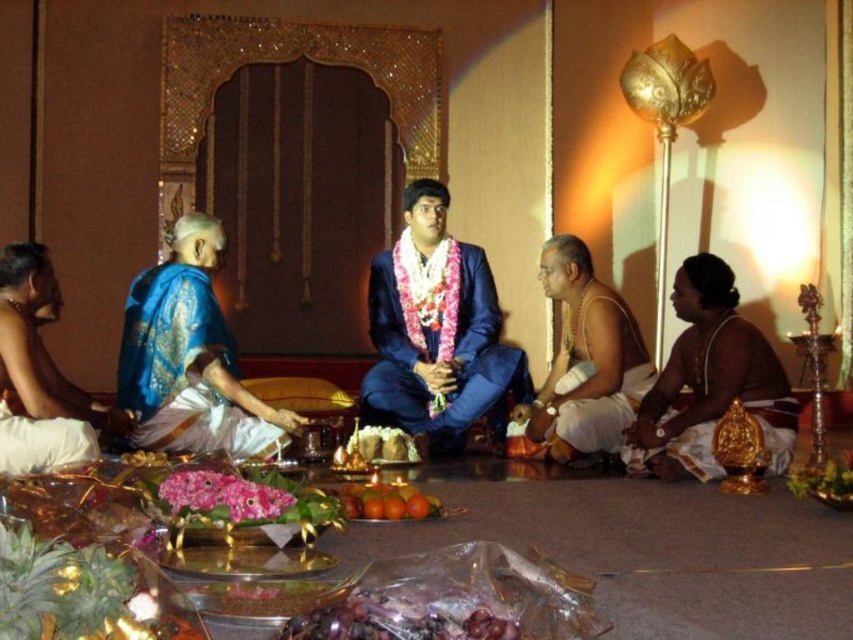
You are attending an Indian ceremony and notice two traditional garments in the scene. The blue silk saree at left and the brown silk dhoti at right. Which one is positioned to the left of the other?

The blue silk saree at left is positioned to the left of the brown silk dhoti at right.

You are a photographer at the ceremony and want to capture both the white silk dhoti at center and the shiny plastic grapes at center in a single photo. Which object should you focus on first to ensure both are in frame?

The white silk dhoti at center is larger in size than the shiny plastic grapes at center, so you should focus on the white silk dhoti at center first to ensure both fit within the frame.

You are an event planner organizing a cultural fashion show. You have two traditional garments to display next to each other on a runway. The garments are the blue silk saree at left and the brown silk dhoti at right. Based on the image, which garment should be placed on the left side of the runway to maintain the same spatial arrangement as in the ceremony?

The blue silk saree at left should be placed on the left side of the runway since in the ceremony it was positioned to the left of the brown silk dhoti at right, maintaining their original spatial arrangement.